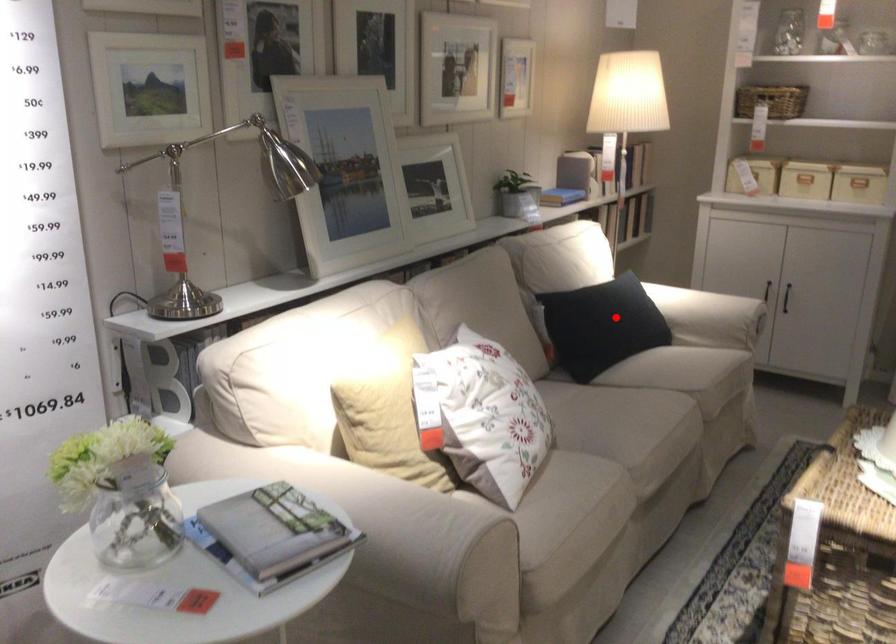
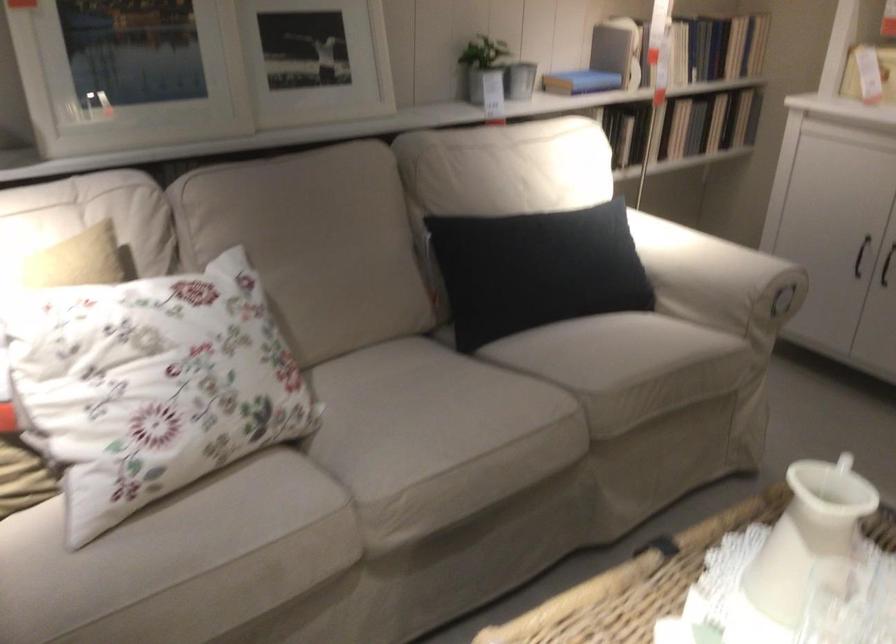
Question: I am providing you with two images of the same scene from different viewpoints. Image1 has a red point marked. In image2, the corresponding 3D location appears at what relative position? Reply with the corresponding letter.

Choices:
 (A) Closer
 (B) Farther

Answer: (A)